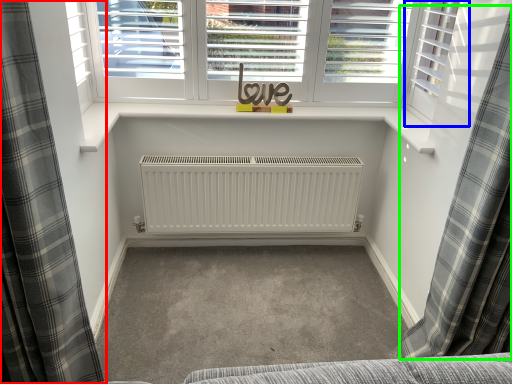
Question: Which object is positioned farthest from curtain (highlighted by a red box)? Select from shutter (highlighted by a blue box) and curtain (highlighted by a green box).

Choices:
 (A) shutter
 (B) curtain

Answer: (A)